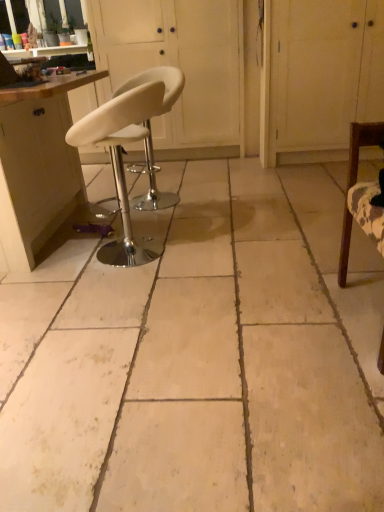
Identify the location of free point in front of white leather stool at center, positioned as the first chair in back-to-front order. (175, 220).